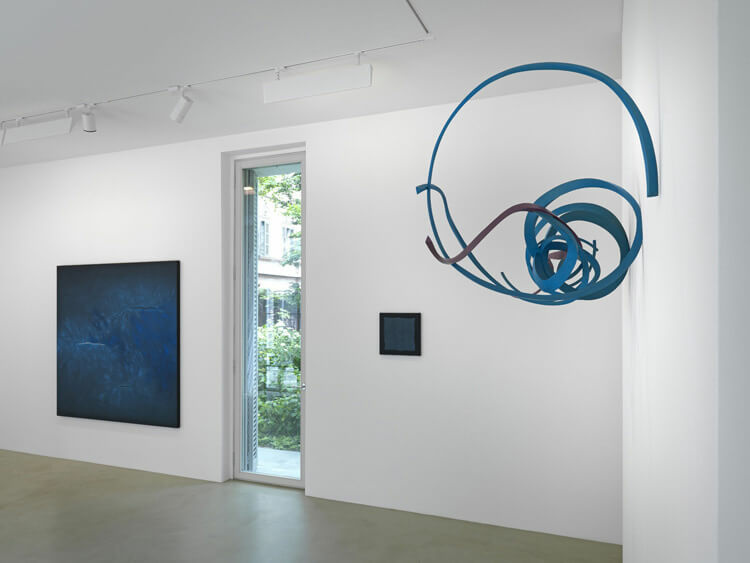
I want to click on window, so click(278, 400).